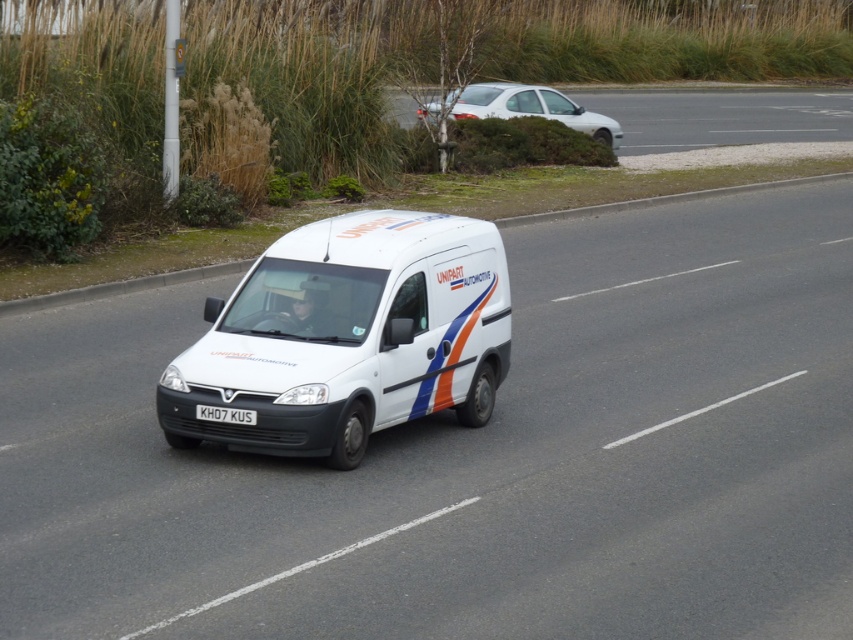
You are a driver approaching the white glossy car at upper center and the white plastic license plate at center. Which object is wider?

The white glossy car at upper center is wider than the white plastic license plate at center.

You are a delivery driver who needs to park your white matte van at center under a carport that can only accommodate vehicles with a height of 1.8 meters. There is also a white matte car at upper center parked nearby. Which vehicle is more likely to exceed the height limit?

The white matte car at upper center is taller than the white matte van at center, so it is more likely to exceed the height limit of 1.8 meters.

You are a driver approaching the white glossy car at upper center and the white plastic license plate at center. Which object will appear bigger in your view as you get closer?

The white glossy car at upper center will appear bigger in your view as you get closer because it has a larger size compared to the white plastic license plate at center.